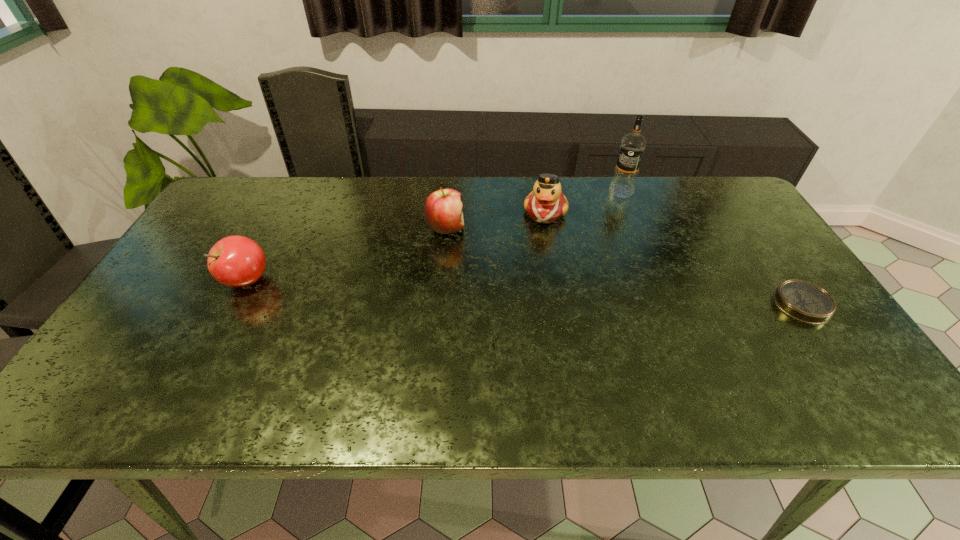
Find the location of a particular element. free space located 0.050m on the stem of the leftmost object is located at coordinates (203, 280).

Locate an element on the screen. vacant position located on the stem of the leftmost object is located at coordinates (180, 280).

Where is `free space located 0.250m on the back of the rightmost object`? The width and height of the screenshot is (960, 540). free space located 0.250m on the back of the rightmost object is located at coordinates (748, 226).

Locate an element on the screen. This screenshot has width=960, height=540. free region located 0.360m on the face of the duck is located at coordinates (528, 318).

Locate an element on the screen. vacant space located on the face of the duck is located at coordinates (535, 281).

Where is `vacant space located 0.140m on the face of the duck`? This screenshot has height=540, width=960. vacant space located 0.140m on the face of the duck is located at coordinates (539, 259).

The height and width of the screenshot is (540, 960). What are the coordinates of `free region located 0.310m on the label of the vodka` in the screenshot? It's located at pyautogui.click(x=584, y=253).

You are a GUI agent. You are given a task and a screenshot of the screen. Output one action in this format:
    pyautogui.click(x=<x>, y=<y>)
    Task: Click on the free space located on the label of the vodka
    This screenshot has height=540, width=960.
    Given the screenshot: What is the action you would take?
    pyautogui.click(x=585, y=252)

Locate an element on the screen. free region located on the label of the vodka is located at coordinates (610, 211).

Image resolution: width=960 pixels, height=540 pixels. Identify the location of blank area located on the bitten side of the right apple. (501, 258).